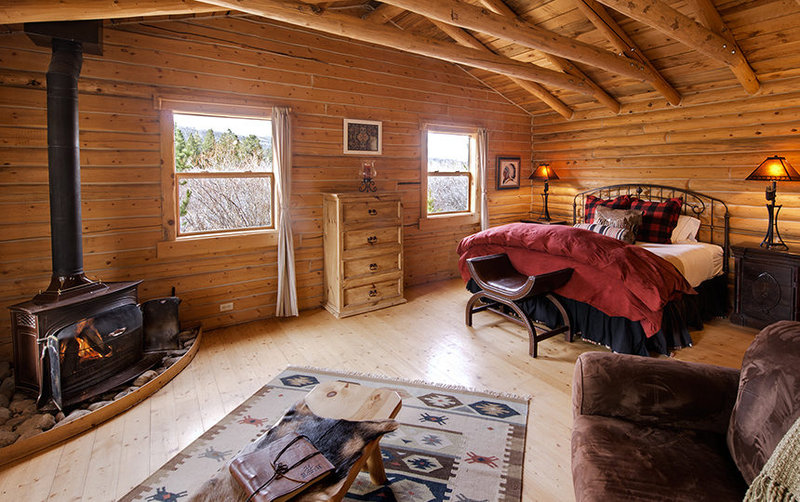
At what (x,y) coordinates should I click in order to perform the action: click on blankets. Please return your answer as a coordinate pair (x, y). The width and height of the screenshot is (800, 502). Looking at the image, I should click on (793, 473), (613, 246).